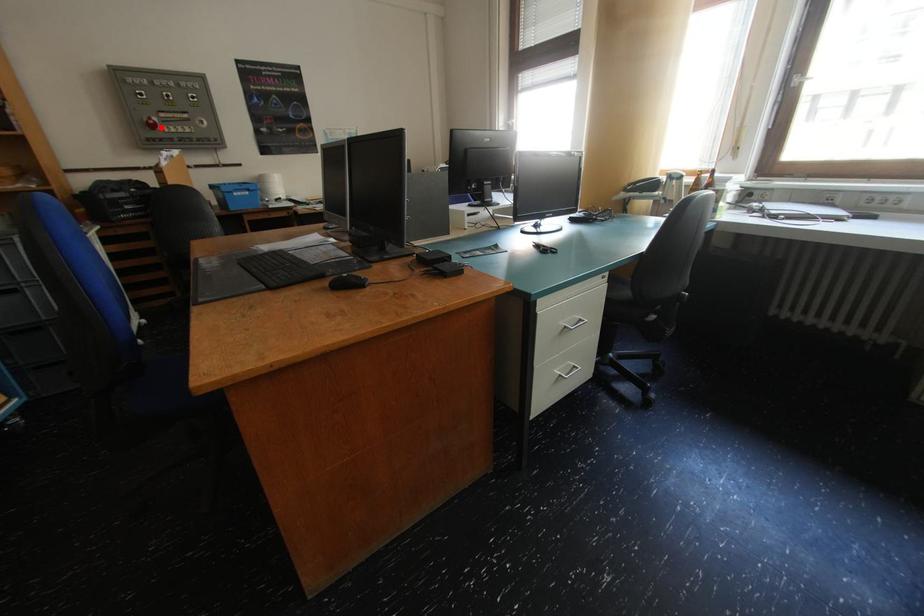
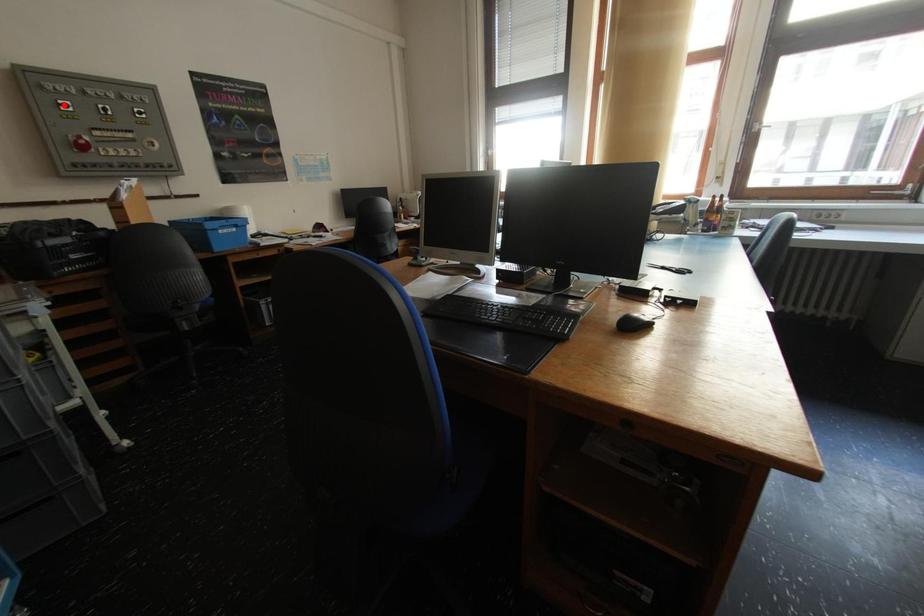
I am providing you with two images of the same scene from different viewpoints. A red point is marked on the first image and another point is marked on the second image. Do the highlighted points in image1 and image2 indicate the same real-world spot?

No